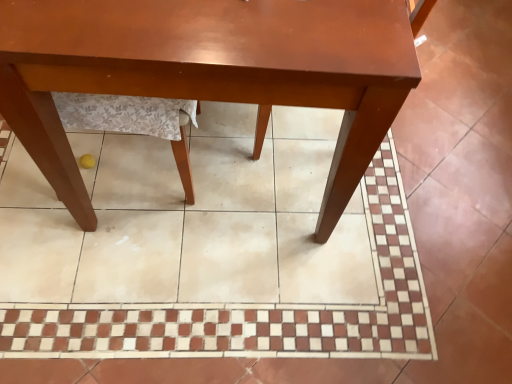
In order to click on free space above brown glossy tile at center (from a real-world perspective) in this screenshot , I will do `click(298, 201)`.